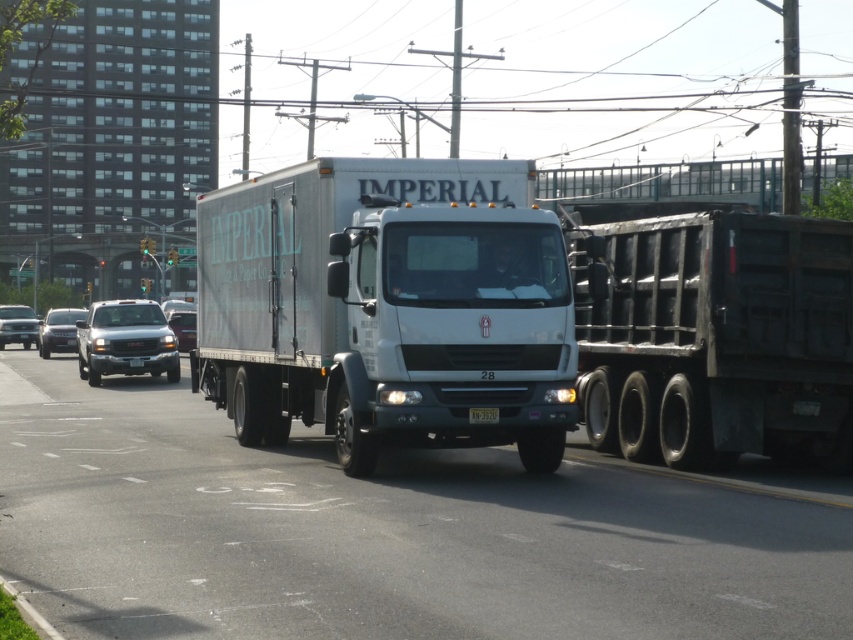
Question: Which of the following is the closest to the observer?

Choices:
 (A) (178, 349)
 (B) (86, 339)
 (C) (292, 593)
 (D) (44, 346)

Answer: (C)

Question: Which of these objects is positioned farthest from the satin black sedan at center?

Choices:
 (A) white glossy truck at center
 (B) black metal trailer truck at right
 (C) matte silver sedan at center

Answer: (B)

Question: Which point is farther to the camera?

Choices:
 (A) (27, 340)
 (B) (474, 406)
 (C) (65, 344)

Answer: (A)

Question: Considering the relative positions of white matte truck at center and black plastic license plate at center in the image provided, where is white matte truck at center located with respect to black plastic license plate at center?

Choices:
 (A) above
 (B) below

Answer: (A)

Question: Is white matte truck at center thinner than silver metallic truck at left?

Choices:
 (A) yes
 (B) no

Answer: (A)

Question: Where is white glossy truck at center located in relation to black plastic license plate at center in the image?

Choices:
 (A) above
 (B) below

Answer: (B)